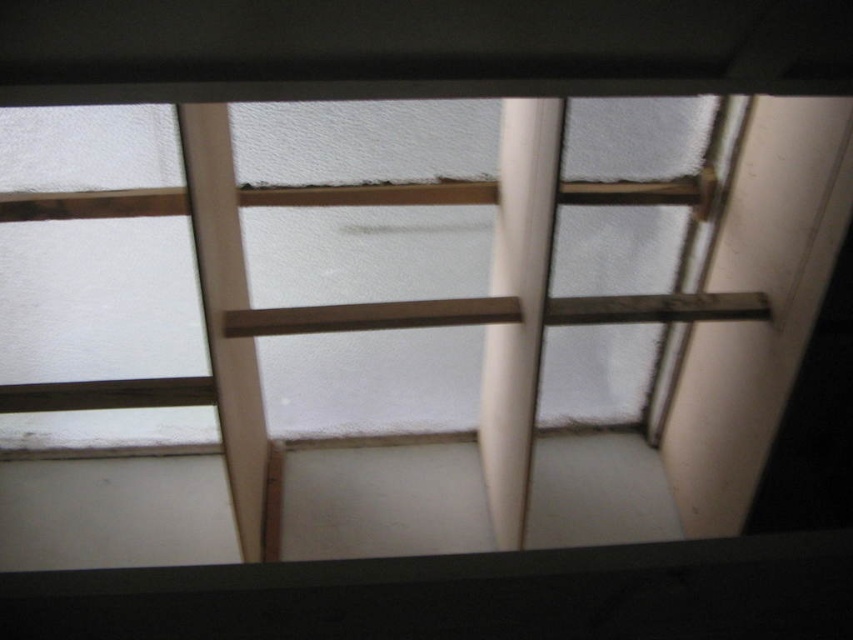
You are standing under the ceiling and want to reach both the point at location (241, 204) and the point at (511, 273). Which point will require you to reach higher?

The point at (511, 273) is further away from the camera, so it will require reaching higher than the point at (241, 204).

You are an interior designer assessing the ceiling structure. You notice the wooden at upper center and the white smooth pole at center. Which object is taller?

The wooden at upper center is taller than the white smooth pole at center.